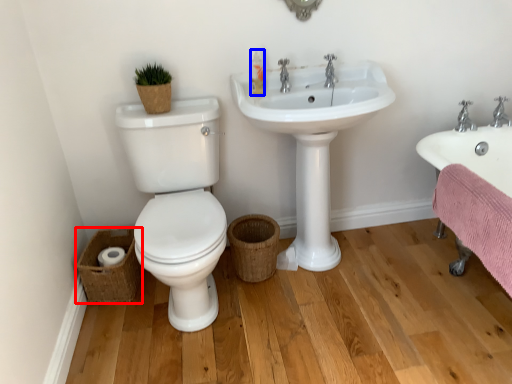
Question: Which object is further to the camera taking this photo, basket (highlighted by a red box) or toiletry (highlighted by a blue box)?

Choices:
 (A) basket
 (B) toiletry

Answer: (A)